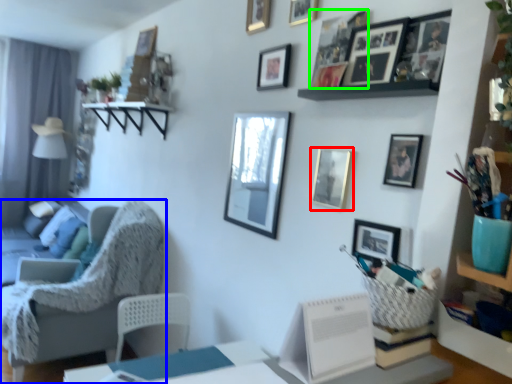
Question: Estimate the real-world distances between objects in this image. Which object is closer to picture frame (highlighted by a red box), chair (highlighted by a blue box) or picture frame (highlighted by a green box)?

Choices:
 (A) chair
 (B) picture frame

Answer: (B)